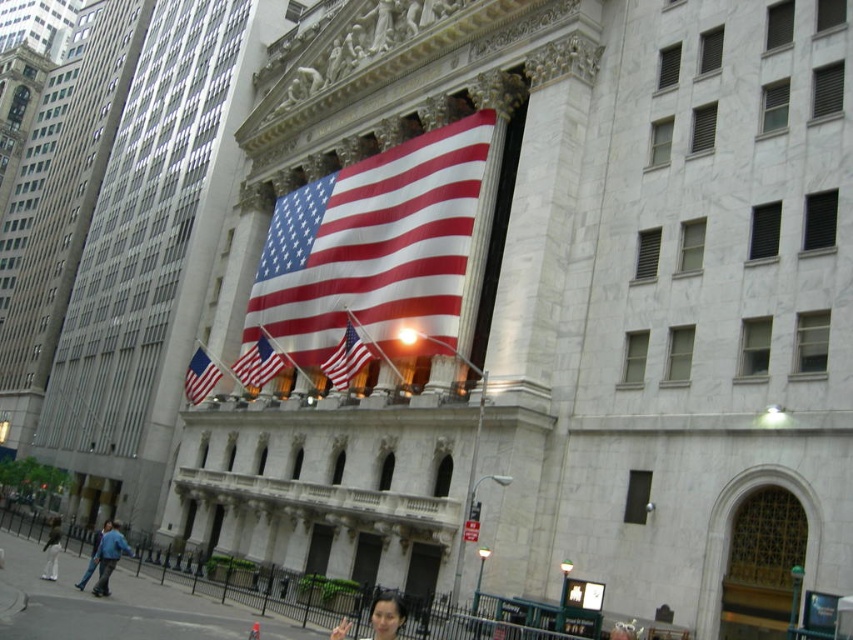
How distant is red-white-striped fabric flag at center from smooth skin face at lower center?

21.42 meters

Measure the distance between point [357,368] and camera.

59.84 meters

In order to click on red-white-striped fabric flag at center in this screenshot , I will do `click(345, 356)`.

Can you confirm if matte fabric flag at center is wider than matte red-white-blue flag at lower left?

Incorrect, matte fabric flag at center's width does not surpass matte red-white-blue flag at lower left's.

Is point (235, 362) positioned behind point (189, 376)?

Yes, point (235, 362) is behind point (189, 376).

Find the location of a particular element. matte fabric flag at center is located at coordinates (x=258, y=364).

Does textured fabric flag at center have a greater height compared to white cotton pants at lower left?

Indeed, textured fabric flag at center has a greater height compared to white cotton pants at lower left.

Does textured fabric flag at center have a greater width compared to white cotton pants at lower left?

Indeed, textured fabric flag at center has a greater width compared to white cotton pants at lower left.

Between point (279, 220) and point (53, 534), which one is positioned behind?

The point (279, 220) is behind.

The width and height of the screenshot is (853, 640). In order to click on textured fabric flag at center in this screenshot , I will do `click(374, 250)`.